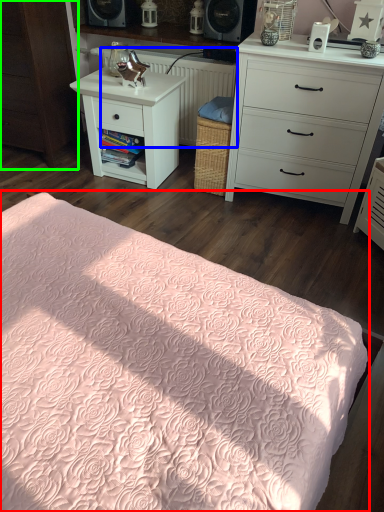
Question: Which is farther away from bed (highlighted by a red box)? radiator (highlighted by a blue box) or cabinetry (highlighted by a green box)?

Choices:
 (A) radiator
 (B) cabinetry

Answer: (A)